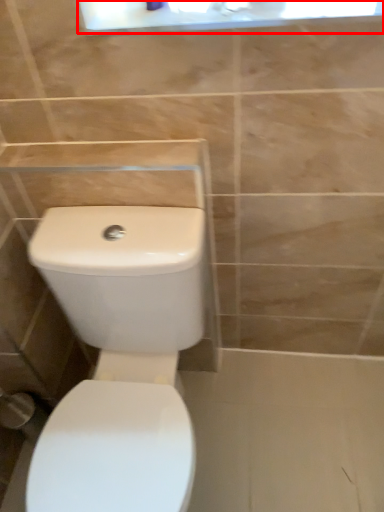
Question: Observing the image, what is the correct spatial positioning of medicine cabinet (annotated by the red box) in reference to toilet?

Choices:
 (A) right
 (B) left

Answer: (A)